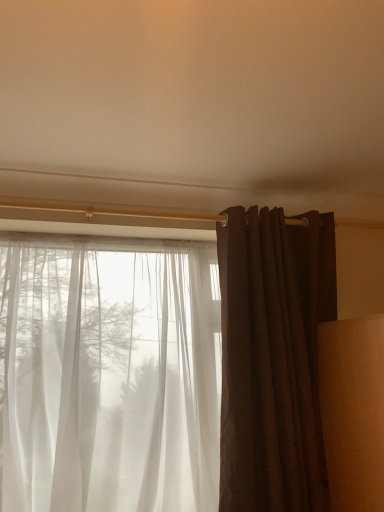
Question: Is matte brown curtain at right, the second curtain in the left-to-right sequence, to the left of sheer white curtain at left, which is counted as the second curtain, starting from the right, from the viewer's perspective?

Choices:
 (A) yes
 (B) no

Answer: (B)

Question: Does matte brown curtain at right, the 1th curtain when ordered from right to left, have a larger size compared to sheer white curtain at left, arranged as the 1th curtain when viewed from the left?

Choices:
 (A) yes
 (B) no

Answer: (B)

Question: From the image's perspective, is matte brown curtain at right, the second curtain in the left-to-right sequence, below sheer white curtain at left, which is counted as the second curtain, starting from the right?

Choices:
 (A) yes
 (B) no

Answer: (B)

Question: Is matte brown curtain at right, the 1th curtain when ordered from right to left, outside of sheer white curtain at left, arranged as the 1th curtain when viewed from the left?

Choices:
 (A) yes
 (B) no

Answer: (A)

Question: From a real-world perspective, is matte brown curtain at right, the second curtain in the left-to-right sequence, over sheer white curtain at left, arranged as the 1th curtain when viewed from the left?

Choices:
 (A) yes
 (B) no

Answer: (A)

Question: Does matte brown curtain at right, the 1th curtain when ordered from right to left, turn towards sheer white curtain at left, arranged as the 1th curtain when viewed from the left?

Choices:
 (A) no
 (B) yes

Answer: (A)

Question: Is sheer white curtain at left, which is counted as the second curtain, starting from the right, turned away from matte brown curtain at right, the second curtain in the left-to-right sequence?

Choices:
 (A) yes
 (B) no

Answer: (B)

Question: Can you confirm if sheer white curtain at left, which is counted as the second curtain, starting from the right, is taller than matte brown curtain at right, the 1th curtain when ordered from right to left?

Choices:
 (A) yes
 (B) no

Answer: (B)

Question: From a real-world perspective, is sheer white curtain at left, arranged as the 1th curtain when viewed from the left, positioned over matte brown curtain at right, the 1th curtain when ordered from right to left, based on gravity?

Choices:
 (A) yes
 (B) no

Answer: (B)

Question: Is sheer white curtain at left, arranged as the 1th curtain when viewed from the left, positioned before matte brown curtain at right, the second curtain in the left-to-right sequence?

Choices:
 (A) no
 (B) yes

Answer: (B)

Question: From a real-world perspective, is sheer white curtain at left, which is counted as the second curtain, starting from the right, beneath matte brown curtain at right, the second curtain in the left-to-right sequence?

Choices:
 (A) yes
 (B) no

Answer: (A)

Question: From the image's perspective, would you say sheer white curtain at left, which is counted as the second curtain, starting from the right, is positioned over matte brown curtain at right, the 1th curtain when ordered from right to left?

Choices:
 (A) yes
 (B) no

Answer: (B)

Question: Considering the positions of matte brown curtain at right, the 1th curtain when ordered from right to left, and sheer white curtain at left, arranged as the 1th curtain when viewed from the left, in the image, is matte brown curtain at right, the 1th curtain when ordered from right to left, taller or shorter than sheer white curtain at left, arranged as the 1th curtain when viewed from the left,?

Choices:
 (A) short
 (B) tall

Answer: (B)